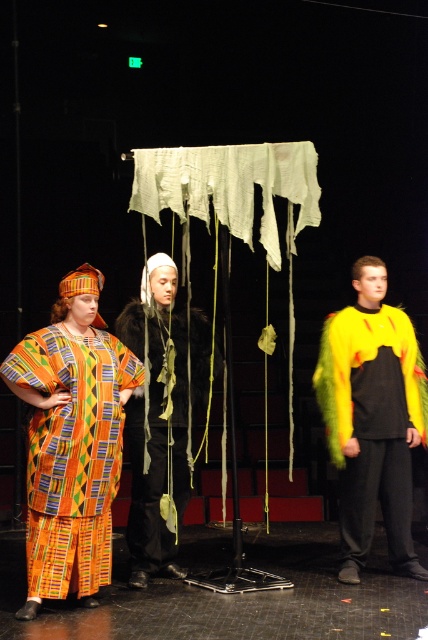
You are an actor on stage and need to quickly find your costume. The stage has a multicolored woven fabric dress at left. Where should you look to find it?

The multicolored woven fabric dress at left is located at point (x=71, y=452), so you should look towards the left side of the stage near the coordinates provided.

You are an actor preparing for a play and need to choose between the multicolored woven fabric dress at left and the fluorescent yellow fur vest at right. Based on their sizes, which one would you pick if you want to wear something taller?

The fluorescent yellow fur vest at right is taller than the multicolored woven fabric dress at left, so you should choose the fluorescent yellow fur vest at right if you want to wear something taller.

You are an actor positioned at the center of the stage. You see two points marked on the stage floor. The first point is at coordinates point (50, 524) and the second point is at coordinates point (348, 518). Which point is closer to you?

Point (50, 524) is closer to the viewer than point (348, 518).